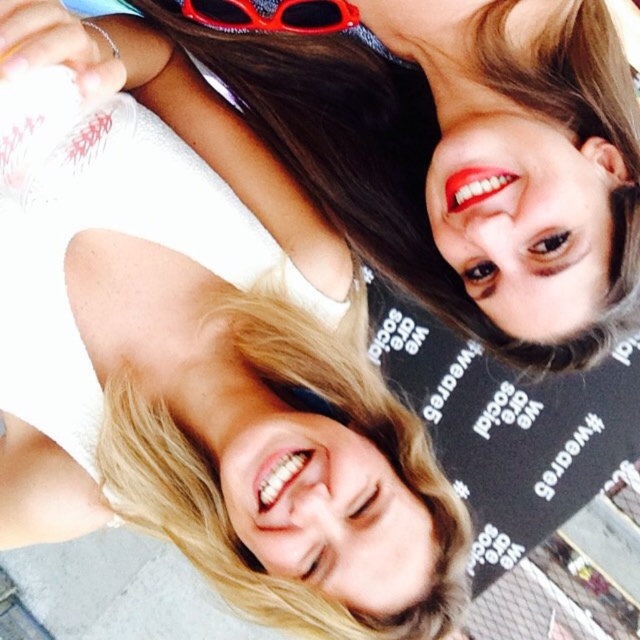
Question: Can you confirm if smooth skin face at upper right is smaller than red plastic goggles at upper center?

Choices:
 (A) yes
 (B) no

Answer: (B)

Question: Which of the following is the closest to the observer?

Choices:
 (A) (218, 28)
 (B) (49, 200)

Answer: (B)

Question: Which of the following is the farthest from the observer?

Choices:
 (A) smooth skin face at upper right
 (B) red plastic goggles at upper center

Answer: (B)

Question: Is smooth skin face at upper right smaller than red plastic goggles at upper center?

Choices:
 (A) yes
 (B) no

Answer: (B)

Question: Is smooth skin face at upper right below red plastic goggles at upper center?

Choices:
 (A) yes
 (B) no

Answer: (A)